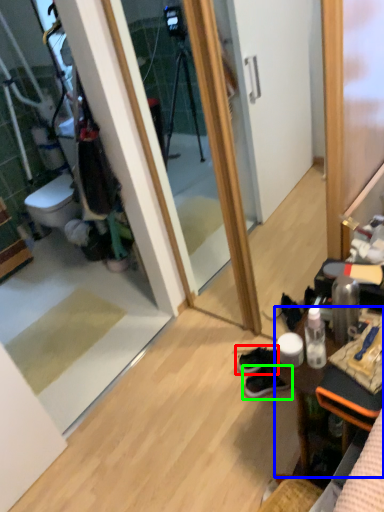
Question: Which object is positioned farthest from footwear (highlighted by a red box)? Select from desk (highlighted by a blue box) and footwear (highlighted by a green box).

Choices:
 (A) desk
 (B) footwear

Answer: (A)